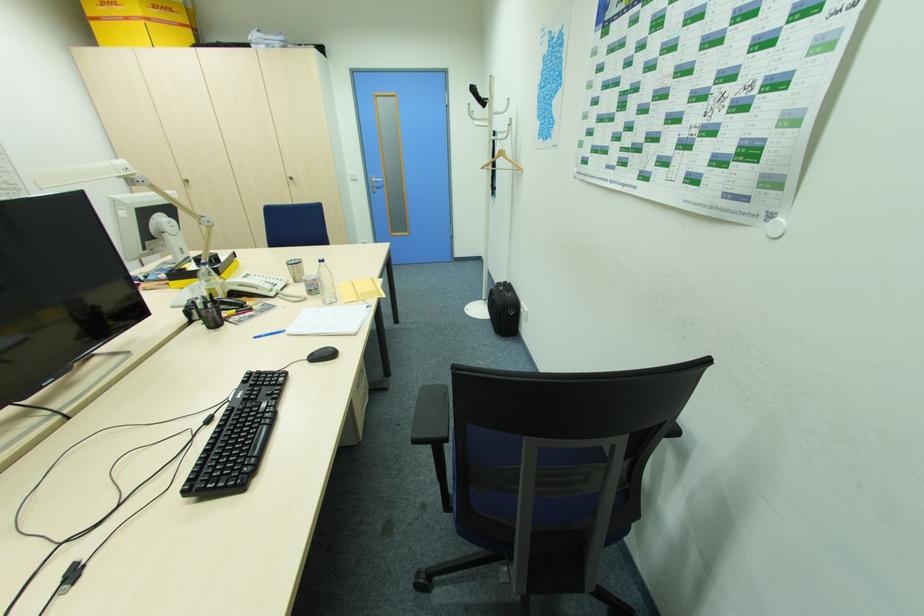
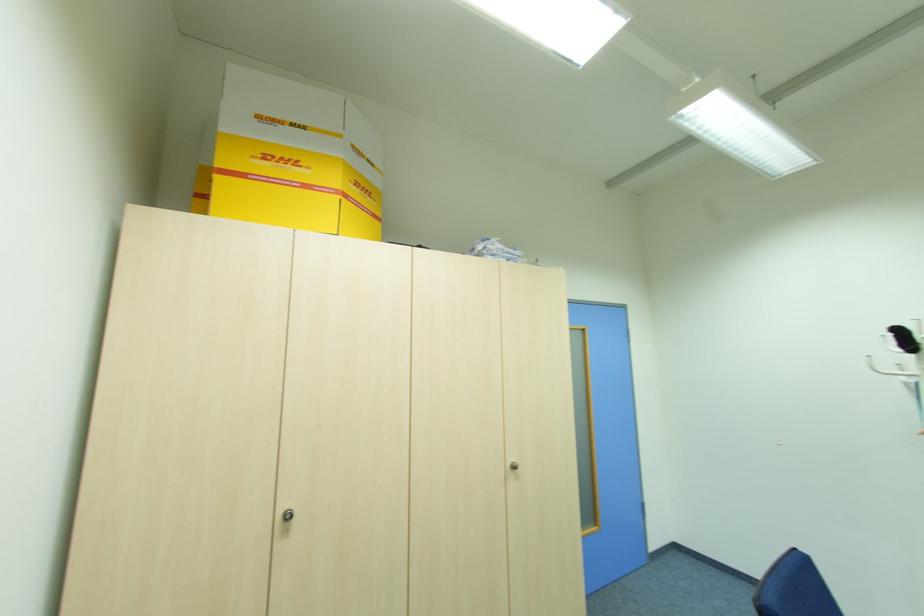
The point at (x=292, y=176) is marked in the first image. Where is the corresponding point in the second image?

(513, 460)